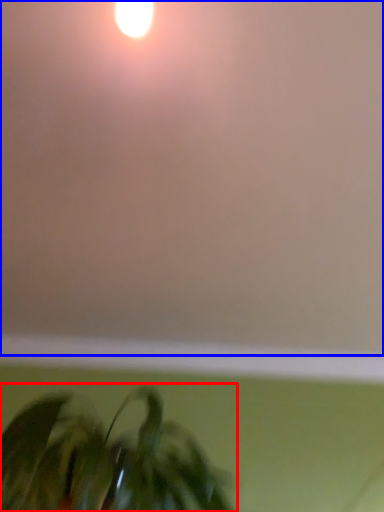
Question: Which object appears closest to the camera in this image, houseplant (highlighted by a red box) or backdrop (highlighted by a blue box)?

Choices:
 (A) houseplant
 (B) backdrop

Answer: (B)